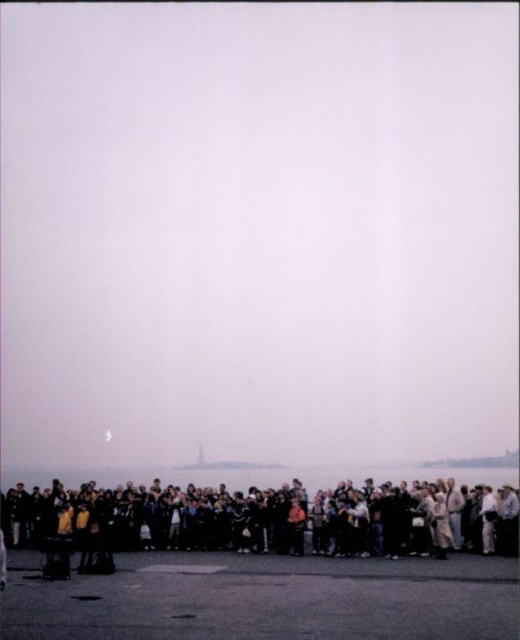
Who is more distant from viewer, (81, 627) or (474, 516)?

Point (474, 516)

Who is taller, dark asphalt tarmac at lower center or dark gray clothing at lower center?

Standing taller between the two is dark gray clothing at lower center.

Between point (306, 556) and point (304, 497), which one is positioned in front?

Point (306, 556) is more forward.

This screenshot has width=520, height=640. I want to click on dark asphalt tarmac at lower center, so [265, 598].